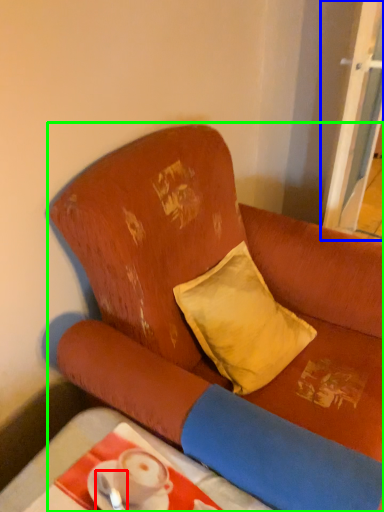
Question: Which object is the farthest from tableware (highlighted by a red box)? Choose among these: screen door (highlighted by a blue box) or studio couch (highlighted by a green box).

Choices:
 (A) screen door
 (B) studio couch

Answer: (A)